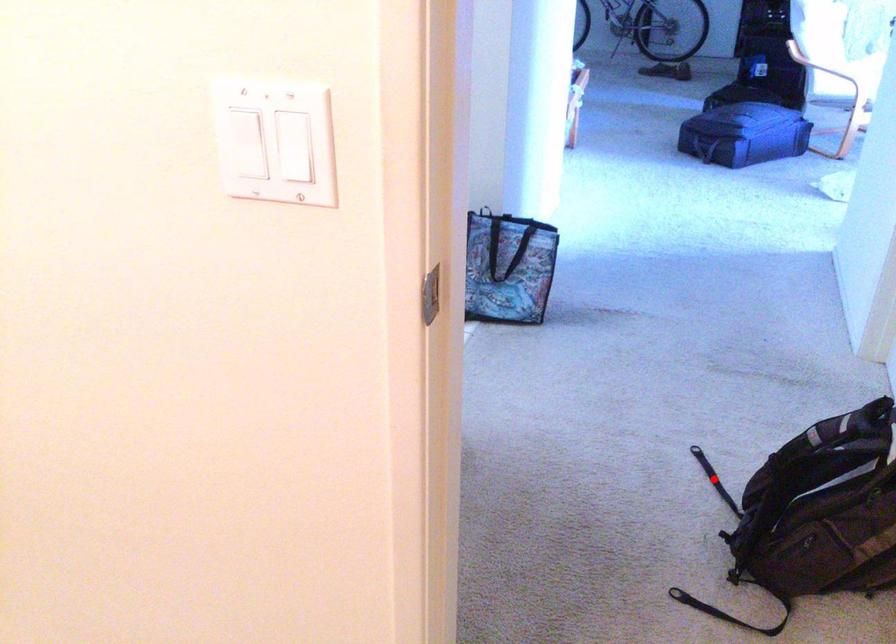
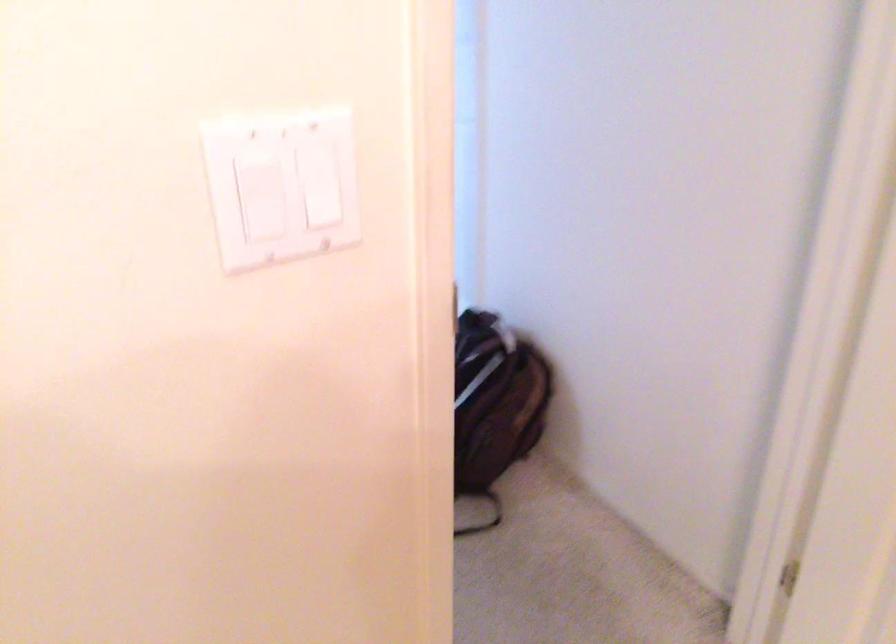
Question: I am providing you with two images of the same scene from different viewpoints. A red point is marked on the first image. Is the red point's position out of view in image 2?

Choices:
 (A) Yes
 (B) No

Answer: (A)